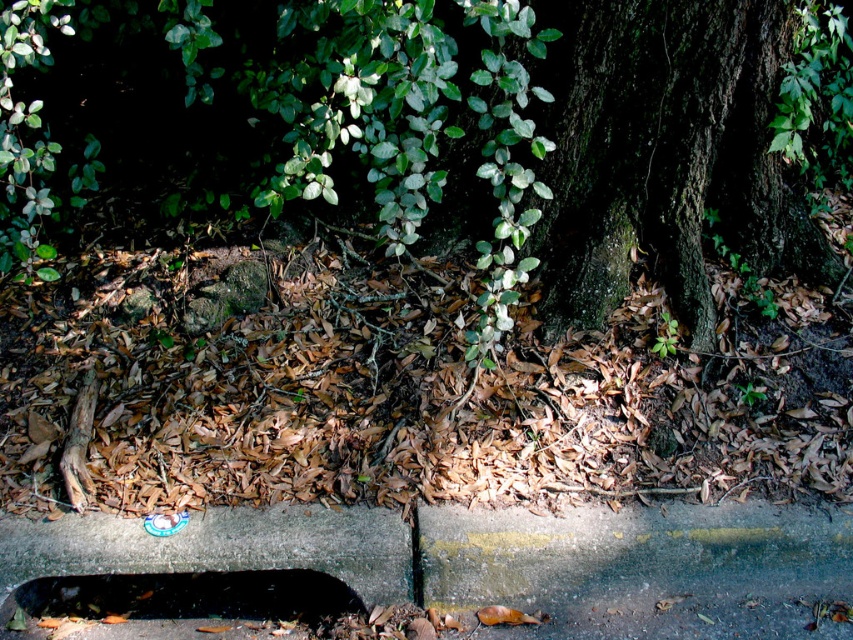
Is point (593, 33) closer to viewer compared to point (236, 611)?

No, it is not.

Can you confirm if green rough bark tree trunk at center is positioned to the right of dark gray concrete hole at lower center?

Indeed, green rough bark tree trunk at center is positioned on the right side of dark gray concrete hole at lower center.

The height and width of the screenshot is (640, 853). I want to click on green rough bark tree trunk at center, so [668, 156].

Which is behind, point (699, 600) or point (181, 612)?

Point (181, 612)

Does point (824, 595) come behind point (175, 576)?

No, it is in front of (175, 576).

Between point (166, 593) and point (73, 598), which one is positioned behind?

The point (166, 593) is more distant.

This screenshot has width=853, height=640. In order to click on gray concrete pavement at lower center in this screenshot , I will do `click(442, 568)`.

Can you confirm if gray concrete pavement at lower center is positioned below green rough bark tree trunk at center?

Yes, gray concrete pavement at lower center is below green rough bark tree trunk at center.

Which is in front, point (688, 518) or point (749, 212)?

Point (688, 518)

Locate an element on the screen. Image resolution: width=853 pixels, height=640 pixels. gray concrete pavement at lower center is located at coordinates click(x=442, y=568).